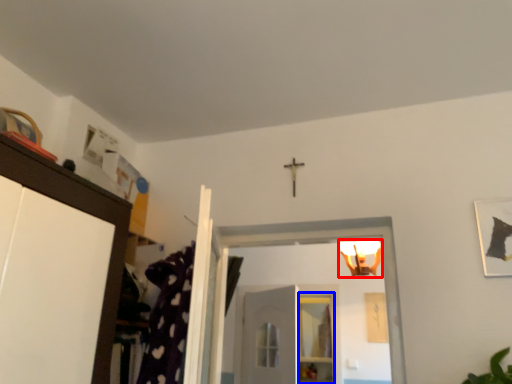
Question: Which object is further to the camera taking this photo, light fixture (highlighted by a red box) or shelf (highlighted by a blue box)?

Choices:
 (A) light fixture
 (B) shelf

Answer: (B)